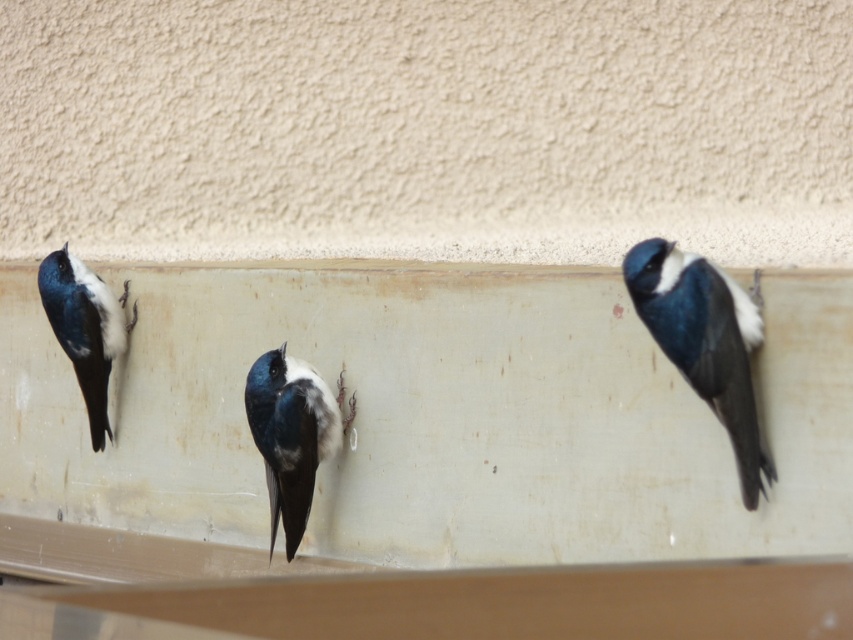
Identify the location of blue glossy swallow at center. Image resolution: width=853 pixels, height=640 pixels. (291, 435).

Is point (315, 428) in front of point (94, 429)?

That is True.

The width and height of the screenshot is (853, 640). Find the location of `blue glossy swallow at center`. blue glossy swallow at center is located at coordinates [291, 435].

Is shiny blue bird at right to the left of shiny blue and white bird at left from the viewer's perspective?

In fact, shiny blue bird at right is to the right of shiny blue and white bird at left.

Which is more to the right, shiny blue bird at right or shiny blue and white bird at left?

From the viewer's perspective, shiny blue bird at right appears more on the right side.

Does point (741, 476) come in front of point (76, 292)?

Yes.

At what (x,y) coordinates should I click in order to perform the action: click on shiny blue bird at right. Please return your answer as a coordinate pair (x, y). Looking at the image, I should click on (704, 340).

Can you confirm if shiny blue bird at right is smaller than blue glossy swallow at center?

Actually, shiny blue bird at right might be larger than blue glossy swallow at center.

In order to click on shiny blue bird at right in this screenshot , I will do `click(704, 340)`.